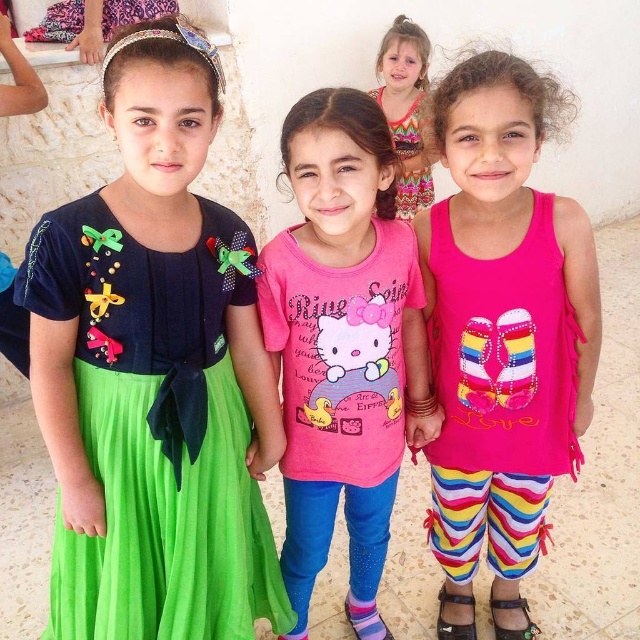
Consider the image. Can you confirm if green fabric dress at left is bigger than brown leather sandal at lower right?

Indeed, green fabric dress at left has a larger size compared to brown leather sandal at lower right.

Does point (161, 420) come behind point (493, 628)?

No, it is not.

Between point (145, 346) and point (529, 636), which one is positioned behind?

Point (529, 636)

The height and width of the screenshot is (640, 640). Find the location of `green fabric dress at left`. green fabric dress at left is located at coordinates (156, 429).

Looking at this image, does green fabric dress at left have a smaller size compared to pink fabric tank top at center?

Yes.

Consider the image. Between green fabric dress at left and pink fabric tank top at center, which one is positioned higher?

pink fabric tank top at center is higher up.

The width and height of the screenshot is (640, 640). Find the location of `green fabric dress at left`. green fabric dress at left is located at coordinates (156, 429).

At what (x,y) coordinates should I click in order to perform the action: click on green fabric dress at left. Please return your answer as a coordinate pair (x, y). This screenshot has width=640, height=640. Looking at the image, I should click on (156, 429).

Does green fabric dress at left have a lesser height compared to pink matte hello kitty shirt at center?

Yes.

Is green fabric dress at left below pink matte hello kitty shirt at center?

Yes, green fabric dress at left is below pink matte hello kitty shirt at center.

Who is more distant from viewer, (x=134, y=330) or (x=401, y=344)?

The point (x=401, y=344) is more distant.

You are a GUI agent. You are given a task and a screenshot of the screen. Output one action in this format:
    pyautogui.click(x=<x>, y=<y>)
    Task: Click on the green fabric dress at left
    The width and height of the screenshot is (640, 640).
    Given the screenshot: What is the action you would take?
    pyautogui.click(x=156, y=429)